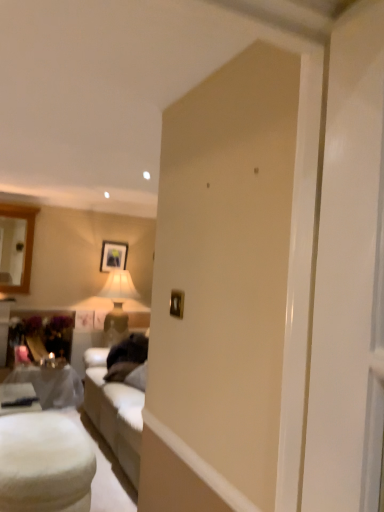
Question: From a real-world perspective, is matte black picture frame at upper center, which ranks as the 2th picture frame in right-to-left order, positioned above or below metallic gold picture frame at center, which is the first picture frame in right-to-left order?

Choices:
 (A) below
 (B) above

Answer: (B)

Question: Based on their sizes in the image, would you say matte black picture frame at upper center, which is the 1th picture frame in left-to-right order, is bigger or smaller than metallic gold picture frame at center, which is the first picture frame in right-to-left order?

Choices:
 (A) big
 (B) small

Answer: (A)

Question: Which object is the closest to the matte black picture frame at upper center, positioned as the 2th picture frame in front-to-back order?

Choices:
 (A) matte gray table at lower left, the first table viewed from the back
 (B) white fluffy ottoman at lower left, which is the first table from front to back
 (C) metallic gold picture frame at center, which is the first picture frame in right-to-left order

Answer: (A)

Question: Which is nearer to the white fluffy ottoman at lower left, which is counted as the 2th table, starting from the back?

Choices:
 (A) matte black picture frame at upper center, which is the 1th picture frame in left-to-right order
 (B) matte gray table at lower left, acting as the second table starting from the front
 (C) metallic gold picture frame at center, arranged as the 1th picture frame when viewed from the front

Answer: (B)